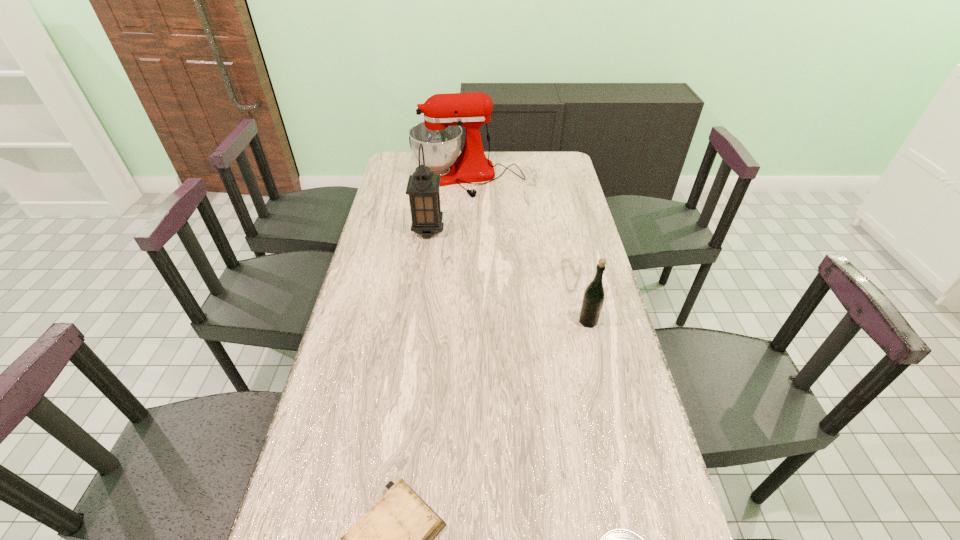
You are a GUI agent. You are given a task and a screenshot of the screen. Output one action in this format:
    pyautogui.click(x=<x>, y=<y>)
    Task: Click on the mixer
    The height and width of the screenshot is (540, 960).
    Given the screenshot: What is the action you would take?
    pyautogui.click(x=440, y=133)

The height and width of the screenshot is (540, 960). In order to click on lantern in this screenshot , I will do `click(423, 186)`.

The width and height of the screenshot is (960, 540). Find the location of `the third shortest object`. the third shortest object is located at coordinates (593, 298).

Locate an element on the screen. the third farthest object is located at coordinates (593, 298).

This screenshot has height=540, width=960. Find the location of `free space located on the bowl side of the mixer`. free space located on the bowl side of the mixer is located at coordinates (465, 234).

Identify the location of vacant space located 0.050m on the left of the fourth nearest object. (399, 230).

I want to click on vacant space located 0.190m on the front of the third tallest object, so click(x=603, y=384).

At what (x,y) coordinates should I click in order to perform the action: click on object that is at the far edge. Please return your answer as a coordinate pair (x, y). The image size is (960, 540). Looking at the image, I should click on (440, 133).

This screenshot has height=540, width=960. Find the location of `mixer positioned at the left edge`. mixer positioned at the left edge is located at coordinates (440, 133).

You are a GUI agent. You are given a task and a screenshot of the screen. Output one action in this format:
    pyautogui.click(x=<x>, y=<y>)
    Task: Click on the lantern that is at the left edge
    The height and width of the screenshot is (540, 960).
    Given the screenshot: What is the action you would take?
    pyautogui.click(x=423, y=186)